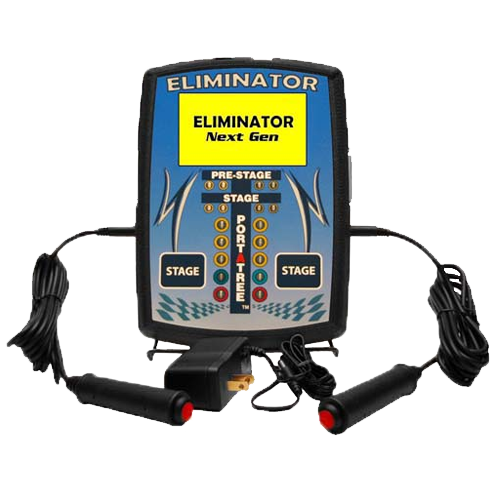
You are a GUI agent. You are given a task and a screenshot of the screen. Output one action in this format:
    pyautogui.click(x=<x>, y=<y>)
    Task: Click on the power plug in
    This screenshot has height=500, width=500.
    Given the screenshot: What is the action you would take?
    pyautogui.click(x=219, y=372)